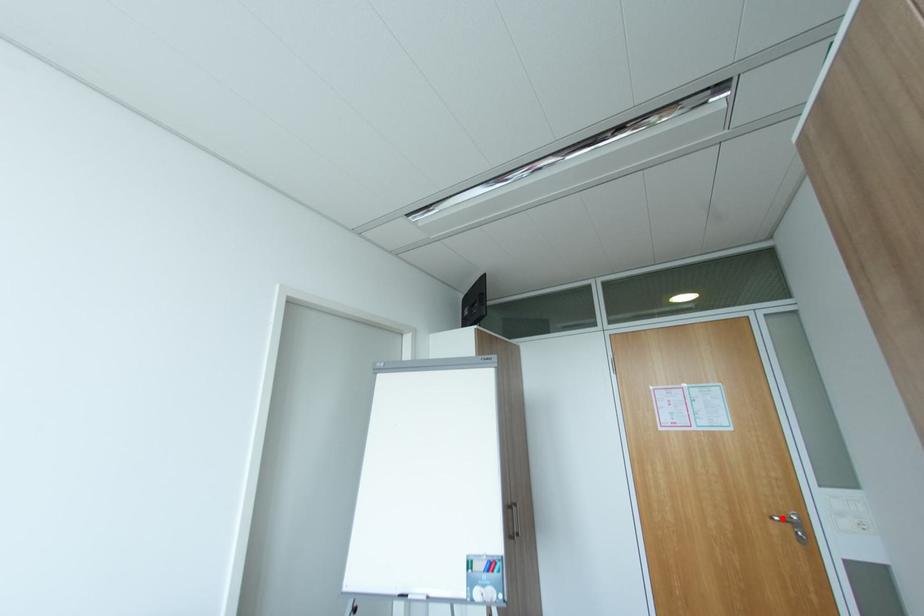
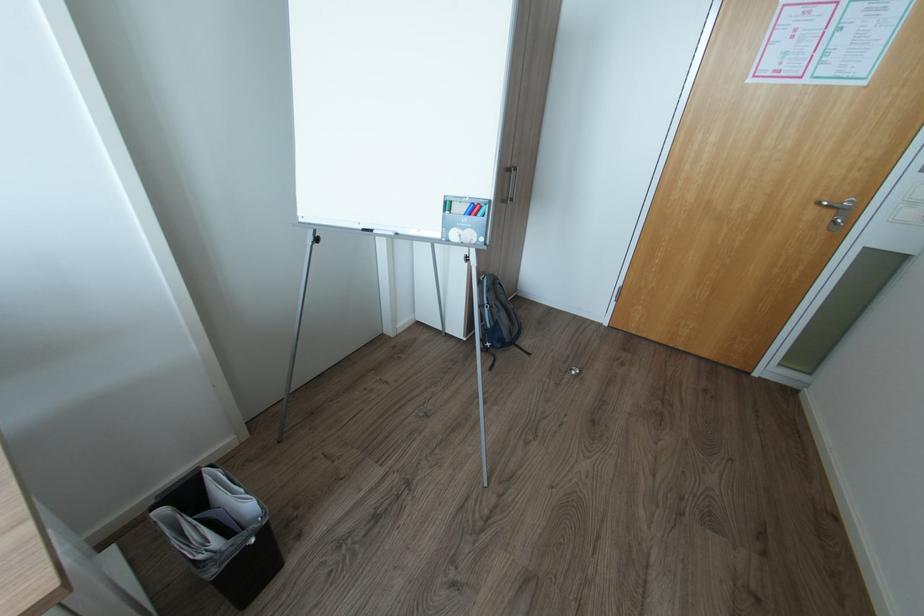
Find the pixel in the second image that matches the highlighted location in the first image.

(830, 204)